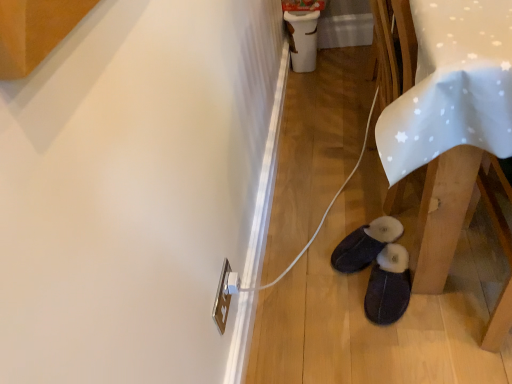
Image resolution: width=512 pixels, height=384 pixels. Identify the location of free space in front of dark suede slippers at lower center, the 1th footwear from the back. (365, 308).